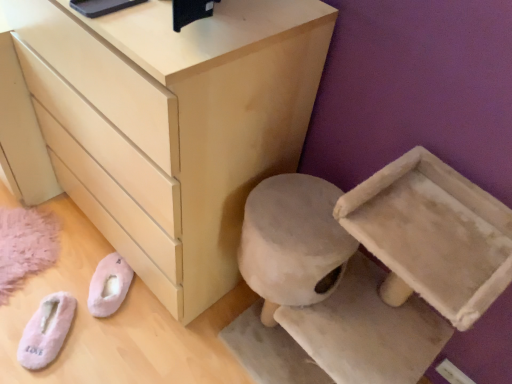
The image size is (512, 384). Identify the location of free space above pink fuzzy slippers at lower left, the second footwear when ordered from left to right (from a real-world perspective). (109, 271).